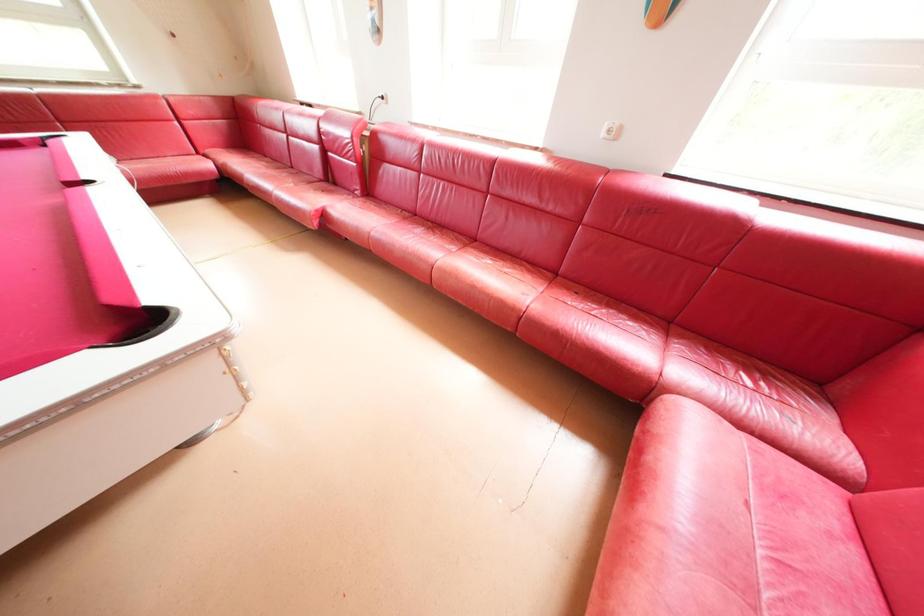
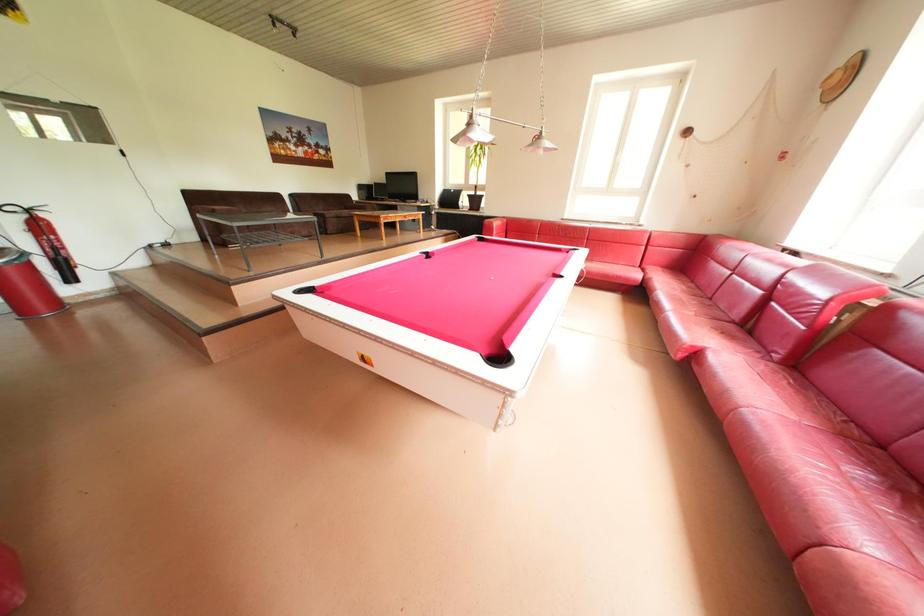
Question: The camera is either moving clockwise (left) or counter-clockwise (right) around the object. The first image is from the beginning of the video and the second image is from the end. Is the camera moving left or right when shooting the video?

Choices:
 (A) Left
 (B) Right

Answer: (B)